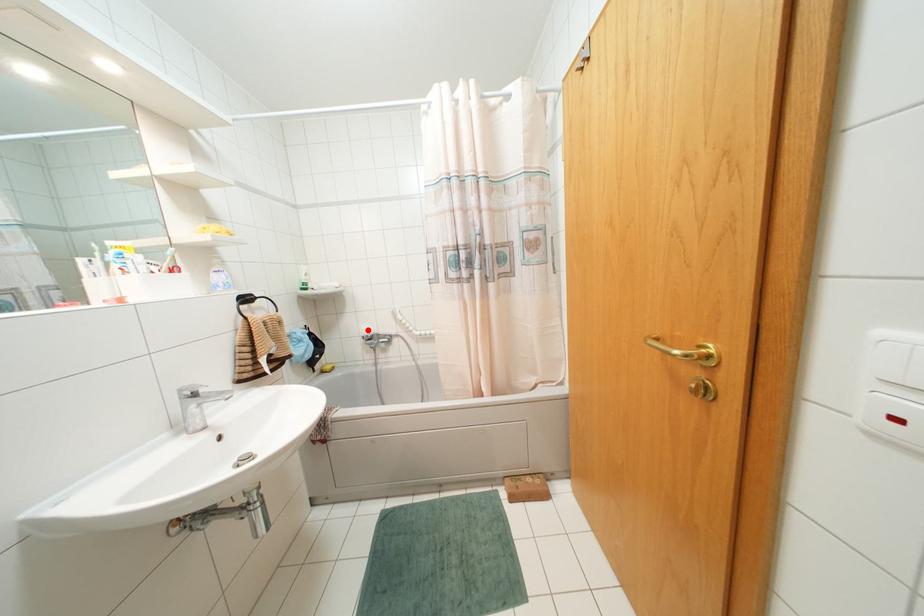
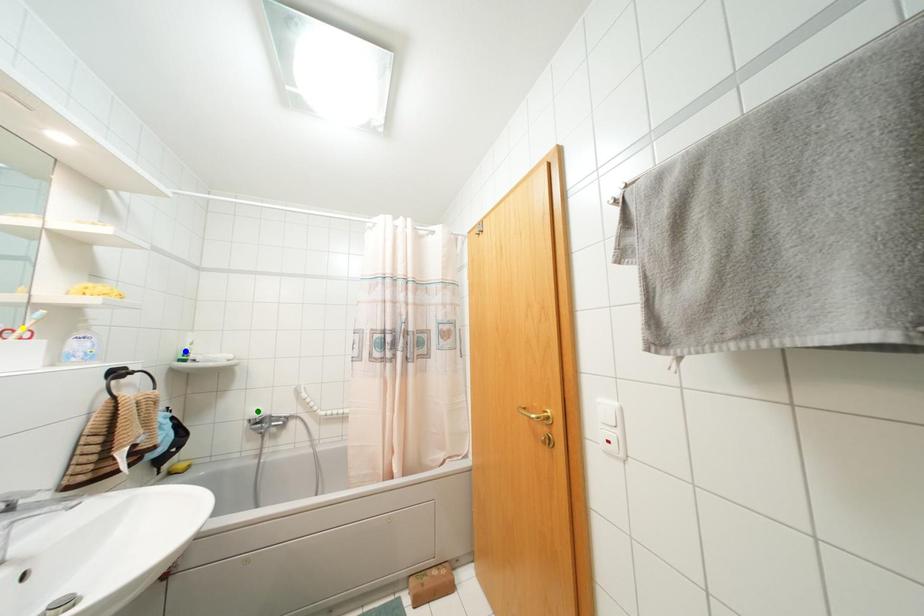
Question: I am providing you with two images of the same scene from different viewpoints. A red point is marked on the first image. You are given multiple points on the second image. In image 2, which mark is for the same physical point as the one in image 1?

Choices:
 (A) green point
 (B) yellow point
 (C) blue point

Answer: (A)